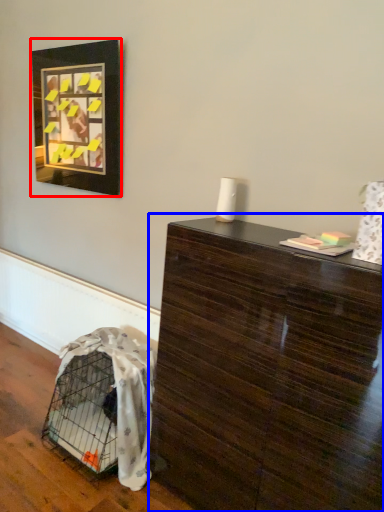
Question: Which object is further to the camera taking this photo, picture frame (highlighted by a red box) or table (highlighted by a blue box)?

Choices:
 (A) picture frame
 (B) table

Answer: (A)